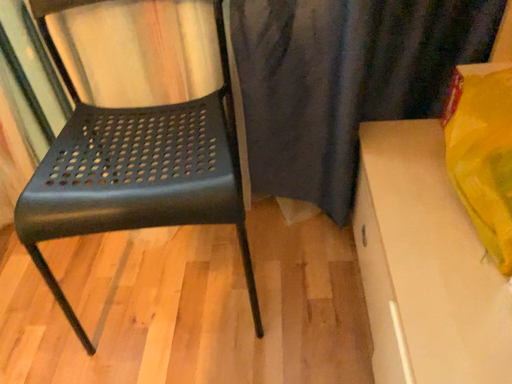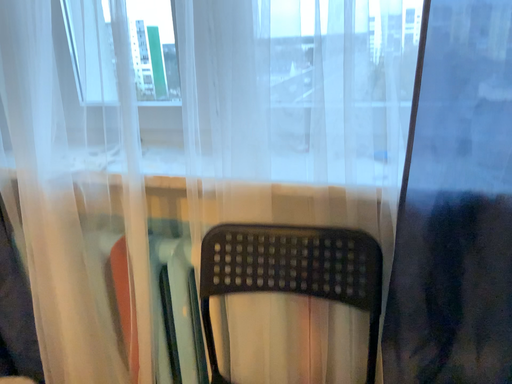
Question: Which way did the camera rotate in the video?

Choices:
 (A) rotated downward
 (B) rotated upward

Answer: (B)